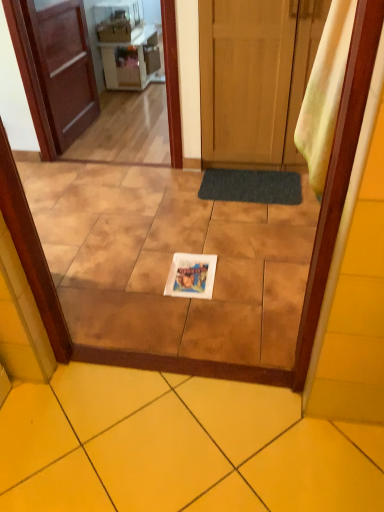
Measure the distance between point (152,78) and camera.

They are 13.03 feet apart.

Where is `metallic silver microwave at upper center, which appears as the second appliance when viewed from the front`? metallic silver microwave at upper center, which appears as the second appliance when viewed from the front is located at coordinates (152, 54).

Measure the distance between brown wooden screen door at upper left and camera.

They are 7.87 feet apart.

The width and height of the screenshot is (384, 512). What do you see at coordinates (30, 76) in the screenshot?
I see `brown wooden screen door at upper left` at bounding box center [30, 76].

You are a GUI agent. You are given a task and a screenshot of the screen. Output one action in this format:
    pyautogui.click(x=<x>, y=<y>)
    Task: Click on the matte white vanity at upper center
    
    Given the screenshot: What is the action you would take?
    pyautogui.click(x=132, y=60)

Does matte white microwave at upper center, which ranks as the 1th appliance in front-to-back order, have a greater height compared to dark gray textured bath mat at center?

Yes.

From the image's perspective, who appears lower, matte white microwave at upper center, positioned as the 2th appliance in right-to-left order, or dark gray textured bath mat at center?

From the image's view, dark gray textured bath mat at center is below.

Is matte white microwave at upper center, positioned as the 2th appliance in right-to-left order, bigger than dark gray textured bath mat at center?

Yes.

Looking at their sizes, would you say matte white microwave at upper center, the 2th appliance when ordered from back to front, is wider or thinner than dark gray textured bath mat at center?

Clearly, matte white microwave at upper center, the 2th appliance when ordered from back to front, has less width compared to dark gray textured bath mat at center.

From a real-world perspective, between yellow ceramic tile at center, which is the 1th ceramic tile from bottom to top, and brown wooden door at left, which is the second door from right to left, who is vertically higher?

brown wooden door at left, which is the second door from right to left, from a real-world perspective.

Does yellow ceramic tile at center, which is the 1th ceramic tile from bottom to top, turn towards brown wooden door at left, which is the second door from right to left?

No.

Which of these two, yellow ceramic tile at center, positioned as the 2th ceramic tile in top-to-bottom order, or brown wooden door at left, which appears as the first door when viewed from the left, is thinner?

brown wooden door at left, which appears as the first door when viewed from the left, is thinner.

Would you say yellow ceramic tile at center, which is the 1th ceramic tile from bottom to top, contains brown wooden door at left, which is the second door from right to left?

No.

Which of these two, yellow ceramic tile at center, positioned as the 2th ceramic tile in top-to-bottom order, or wooden door at center, the 2th door viewed from the left, stands shorter?

yellow ceramic tile at center, positioned as the 2th ceramic tile in top-to-bottom order, is shorter.

Does point (125, 488) lie behind point (202, 60)?

No, it is not.

Are yellow ceramic tile at center, which is the 1th ceramic tile from bottom to top, and wooden door at center, which is the first door from right to left, located far from each other?

yellow ceramic tile at center, which is the 1th ceramic tile from bottom to top, is far away from wooden door at center, which is the first door from right to left.

What's the angular difference between matte white vanity at upper center and white glossy plate at center, which is the 2th ceramic tile in bottom-to-top order,'s facing directions?

matte white vanity at upper center and white glossy plate at center, which is the 2th ceramic tile in bottom-to-top order, are facing 90.1 degrees away from each other.

Between point (143, 38) and point (81, 229), which one is positioned in front?

The point (81, 229) is in front.

The width and height of the screenshot is (384, 512). What are the coordinates of `vanity behind the white glossy plate at center, placed as the 2th ceramic tile when sorted from front to back` in the screenshot? It's located at (132, 60).

Considering the sizes of objects matte white vanity at upper center and white glossy plate at center, which is the 2th ceramic tile in bottom-to-top order, in the image provided, who is shorter, matte white vanity at upper center or white glossy plate at center, which is the 2th ceramic tile in bottom-to-top order,?

With less height is white glossy plate at center, which is the 2th ceramic tile in bottom-to-top order.

Is wooden door at center, which is the first door from right to left, closer to the viewer compared to white glossy book at center?

That is False.

From the image's perspective, is wooden door at center, the 2th door viewed from the left, above or below white glossy book at center?

Based on their image positions, wooden door at center, the 2th door viewed from the left, is located above white glossy book at center.

Could you tell me if wooden door at center, which is the first door from right to left, is turned towards white glossy book at center?

Yes.

From a real-world perspective, is matte white vanity at upper center positioned above or below metallic silver microwave at upper center, placed as the 1th appliance when sorted from right to left?

From a real-world perspective, matte white vanity at upper center is physically above metallic silver microwave at upper center, placed as the 1th appliance when sorted from right to left.

Is point (111, 59) behind point (148, 48)?

No.

Find the location of a particular element. appliance on the right of matte white vanity at upper center is located at coordinates (152, 54).

Would you say yellow fabric curtain at right is outside dark gray textured bath mat at center?

Absolutely, yellow fabric curtain at right is external to dark gray textured bath mat at center.

Which object is further away from the camera, yellow fabric curtain at right or dark gray textured bath mat at center?

dark gray textured bath mat at center is more distant.

Is point (347, 36) closer or farther from the camera than point (233, 189)?

Point (347, 36) is positioned closer to the camera compared to point (233, 189).

From a real-world perspective, between yellow fabric curtain at right and dark gray textured bath mat at center, who is vertically lower?

dark gray textured bath mat at center, from a real-world perspective.

Where is `bath mat below the matte white microwave at upper center, positioned as the 2th appliance in right-to-left order (from the image's perspective)`? bath mat below the matte white microwave at upper center, positioned as the 2th appliance in right-to-left order (from the image's perspective) is located at coordinates (251, 186).

Locate an element on the screen. Image resolution: width=384 pixels, height=512 pixels. door on the left of the yellow ceramic tile at center, which is the 1th ceramic tile from bottom to top is located at coordinates (63, 67).

Estimate the real-world distances between objects in this image. Which object is further from yellow ceramic tile at center, acting as the first ceramic tile starting from the front, matte white vanity at upper center or metallic silver microwave at upper center, which ranks as the 1th appliance in back-to-front order?

Based on the image, metallic silver microwave at upper center, which ranks as the 1th appliance in back-to-front order, appears to be further to yellow ceramic tile at center, acting as the first ceramic tile starting from the front.

Based on their spatial positions, is wooden door at center, which is the first door from right to left, or brown wooden door at left, which is the second door from right to left, further from matte white vanity at upper center?

wooden door at center, which is the first door from right to left.

Which object lies further to the anchor point brown wooden screen door at upper left, wooden door at center, the 2th door viewed from the left, or white glossy plate at center, positioned as the 1th ceramic tile in top-to-bottom order?

wooden door at center, the 2th door viewed from the left, is positioned further to the anchor brown wooden screen door at upper left.

Based on their spatial positions, is white glossy book at center or brown wooden screen door at upper left closer to dark gray textured bath mat at center?

Among the two, white glossy book at center is located nearer to dark gray textured bath mat at center.

Considering their positions, is white glossy book at center positioned further to yellow fabric curtain at right than brown wooden screen door at upper left?

brown wooden screen door at upper left is positioned further to the anchor yellow fabric curtain at right.

When comparing their distances from matte white microwave at upper center, positioned as the first appliance in left-to-right order, does yellow fabric curtain at right or white glossy book at center seem further?

Based on the image, yellow fabric curtain at right appears to be further to matte white microwave at upper center, positioned as the first appliance in left-to-right order.

From the image, which object appears to be farther from white glossy book at center, brown wooden door at left, which appears as the first door when viewed from the left, or matte white microwave at upper center, positioned as the first appliance in left-to-right order?

The object further to white glossy book at center is matte white microwave at upper center, positioned as the first appliance in left-to-right order.

Looking at the image, which one is located closer to yellow fabric curtain at right, metallic silver microwave at upper center, which appears as the second appliance when viewed from the front, or brown wooden door at left, which appears as the first door when viewed from the left?

Among the two, brown wooden door at left, which appears as the first door when viewed from the left, is located nearer to yellow fabric curtain at right.

Identify the location of vanity between brown wooden screen door at upper left and metallic silver microwave at upper center, which ranks as the 1th appliance in back-to-front order, along the z-axis. The image size is (384, 512). (x=132, y=60).

What are the coordinates of `bath mat between matte white microwave at upper center, positioned as the 2th appliance in right-to-left order, and white glossy book at center, in the vertical direction` in the screenshot? It's located at (251, 186).

Find the location of `bath mat between brown wooden screen door at upper left and matte white vanity at upper center from front to back`. bath mat between brown wooden screen door at upper left and matte white vanity at upper center from front to back is located at coordinates (251, 186).

Locate an element on the screen. The image size is (384, 512). copy between brown wooden screen door at upper left and yellow ceramic tile at center, positioned as the 2th ceramic tile in back-to-front order, vertically is located at coordinates (191, 276).